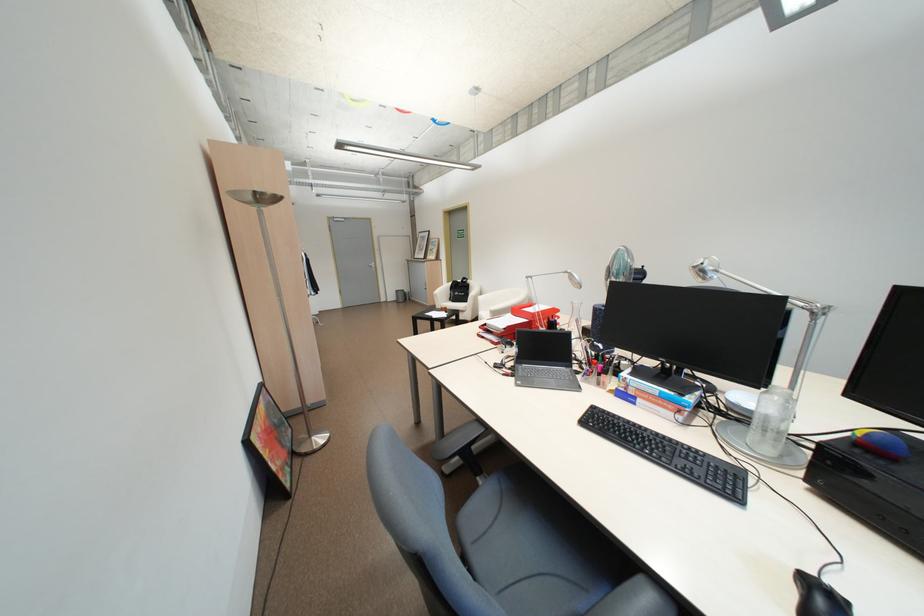
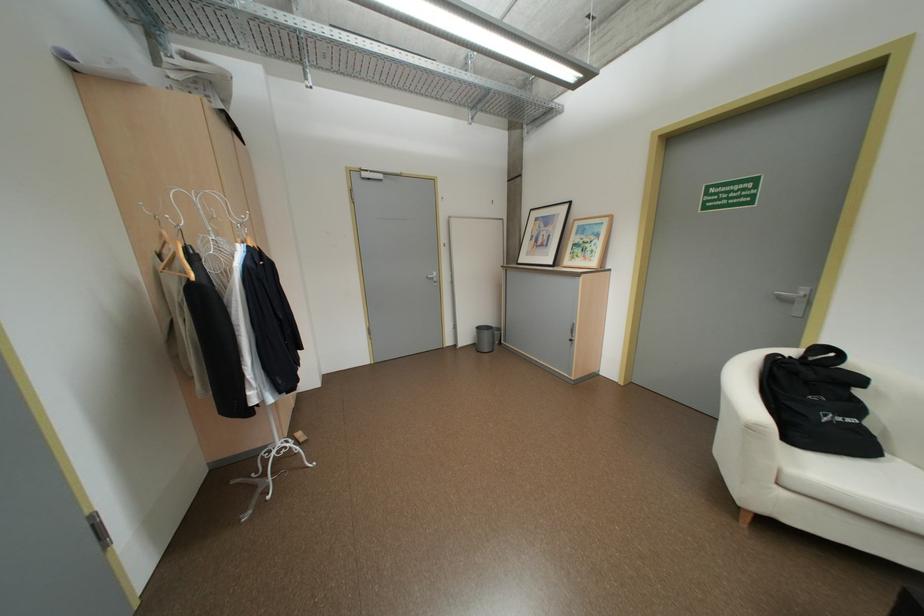
Locate, in the second image, the point that corresponds to (x=472, y=281) in the first image.

(815, 355)